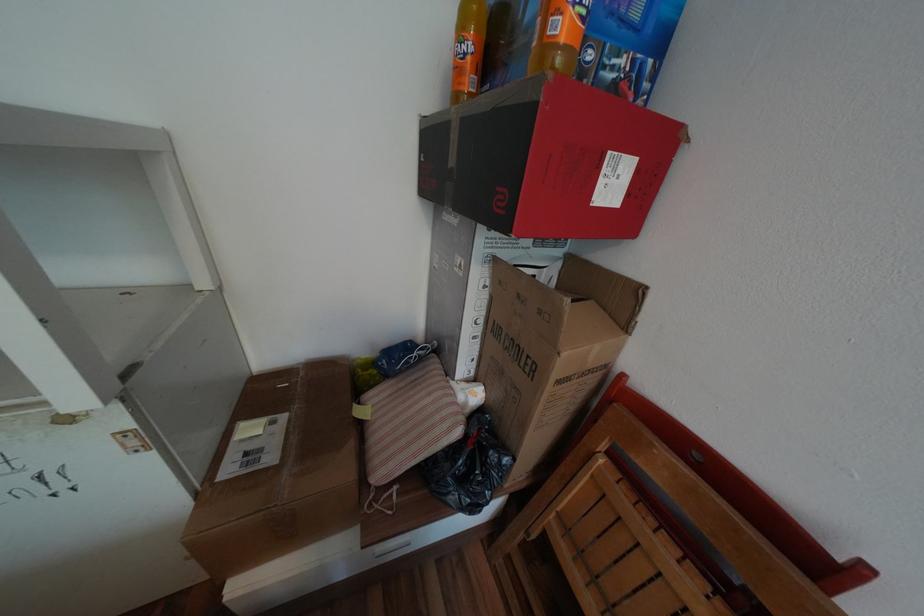
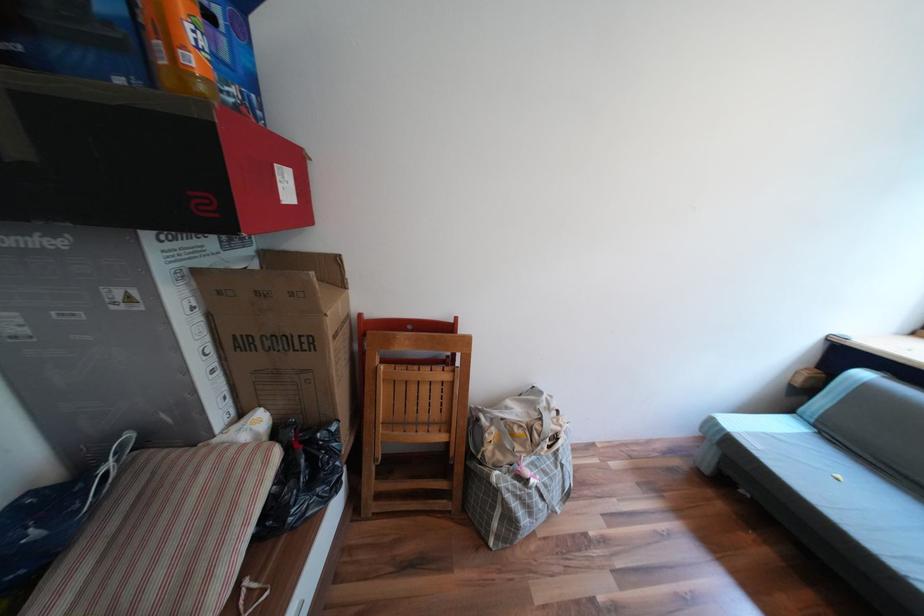
Locate, in the second image, the point that corresponds to (x=500, y=453) in the first image.

(327, 435)